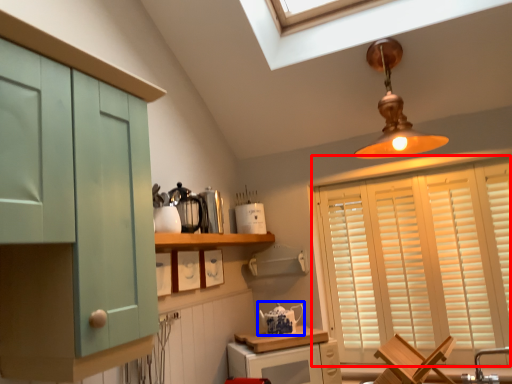
Question: Which object appears farthest to the camera in this image, window (highlighted by a red box) or tea pot (highlighted by a blue box)?

Choices:
 (A) window
 (B) tea pot

Answer: (B)